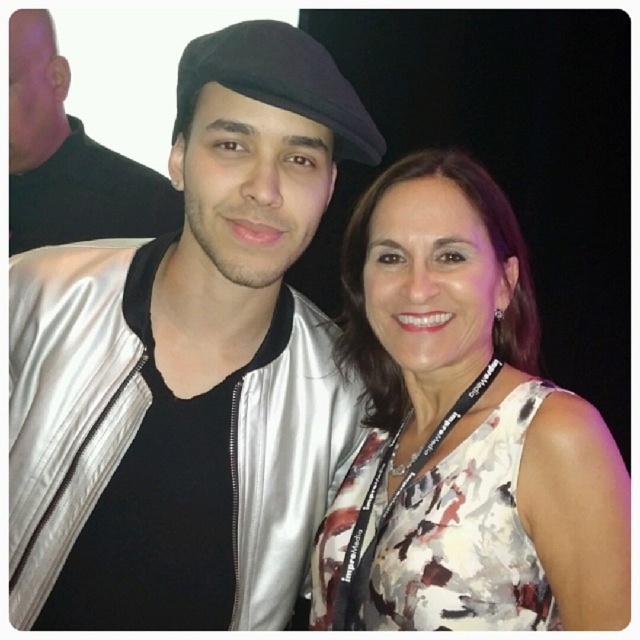
You are a photographer setting up for a portrait. You want to ensure that both the white floral dress at center and the black felt beret at center are clearly visible in the frame. Based on their positions, which one should you focus on first to ensure proper exposure?

The white floral dress at center is below the black felt beret at center. Since the dress is lighter in color, you should focus on the white floral dress at center first to avoid overexposing the brighter area, then adjust for the darker tones of the black felt beret at center.

You are a photographer trying to capture a closeup shot of both the white floral dress at center and the black felt beret at center. Given that your camera has a maximum focus range of 12 inches, will you be able to focus on both objects simultaneously?

The distance between the white floral dress at center and the black felt beret at center is 13.00 inches. Since the camera can only focus within 12 inches, the objects are slightly out of the focus range. Therefore, you cannot focus on both simultaneously.

You are a photographer trying to adjust the lighting for a photo shoot. You notice the white floral dress at center and the black felt beret at center in the scene. Which object should you focus the light on to ensure it stands out more due to its height?

The white floral dress at center is much taller than the black felt beret at center, so focusing the light on the white floral dress at center will ensure it stands out more due to its height.